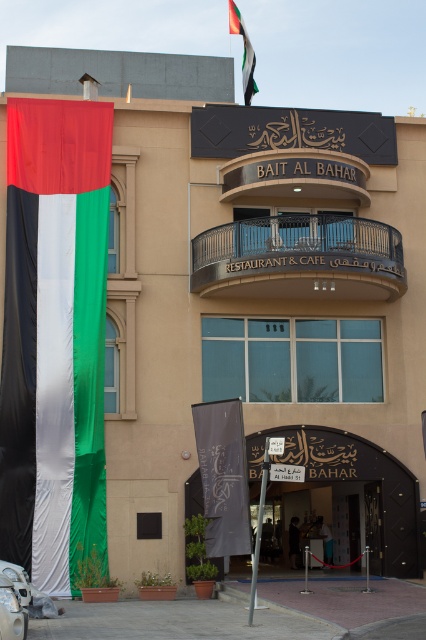
Can you confirm if silky fabric flag at left is positioned to the right of metallic pole at center?

No, silky fabric flag at left is not to the right of metallic pole at center.

Does silky fabric flag at left have a larger size compared to metallic pole at center?

Indeed, silky fabric flag at left has a larger size compared to metallic pole at center.

Who is more distant from viewer, (37, 230) or (255, 552)?

Positioned behind is point (37, 230).

The width and height of the screenshot is (426, 640). Identify the location of silky fabric flag at left. (54, 337).

Who is positioned more to the left, embossed fabric flag at upper center or metallic pole at center?

Positioned to the left is embossed fabric flag at upper center.

Between point (249, 40) and point (252, 624), which one is positioned in front?

Point (252, 624)

Locate an element on the screen. embossed fabric flag at upper center is located at coordinates (244, 51).

Find the location of a particular element. This screenshot has width=426, height=640. embossed fabric flag at upper center is located at coordinates (244, 51).

Between silky fabric flag at left and metallic wrought iron balcony at center, which one is positioned lower?

Positioned lower is silky fabric flag at left.

Image resolution: width=426 pixels, height=640 pixels. In order to click on silky fabric flag at left in this screenshot , I will do `click(54, 337)`.

The image size is (426, 640). In order to click on silky fabric flag at left in this screenshot , I will do `click(54, 337)`.